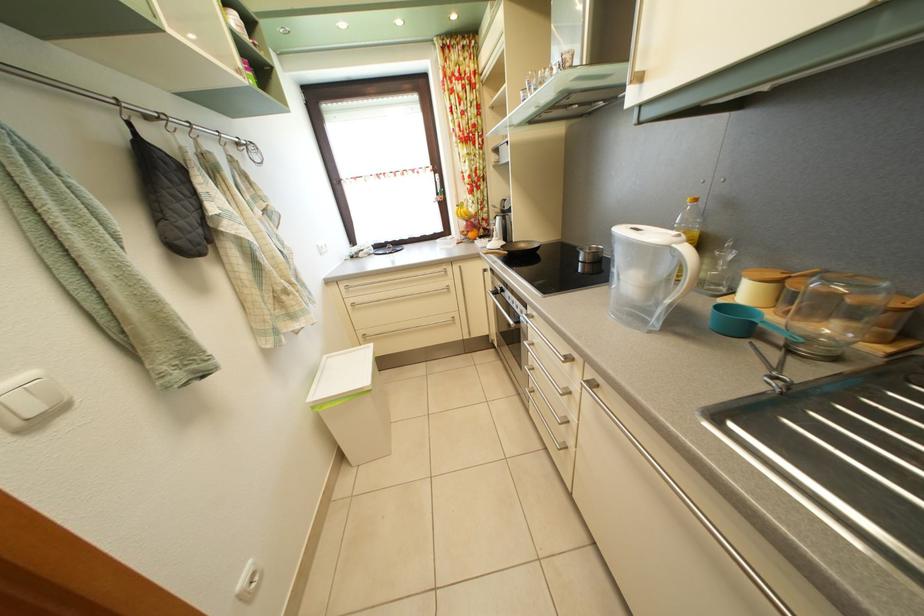
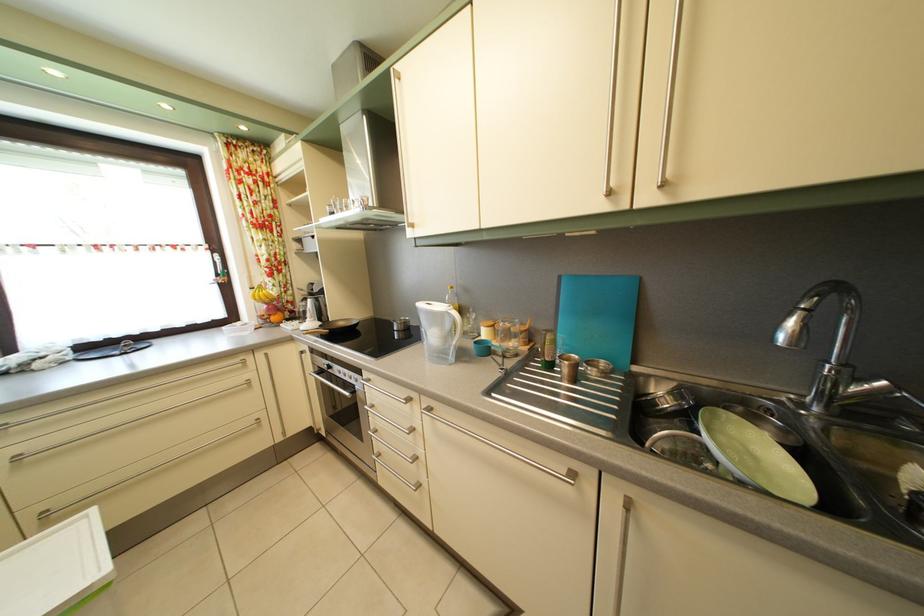
Where in the second image is the point corresponding to (465,275) from the first image?

(268, 363)